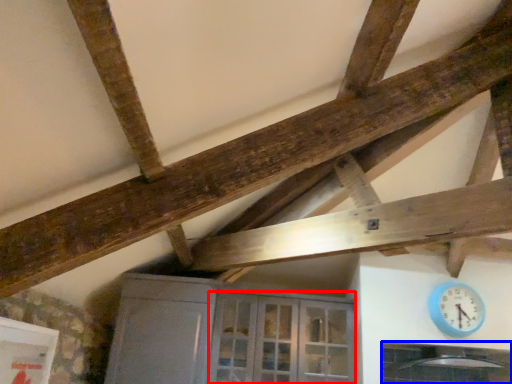
Question: Which object appears closest to the camera in this image, glass door (highlighted by a red box) or window (highlighted by a blue box)?

Choices:
 (A) glass door
 (B) window

Answer: (B)